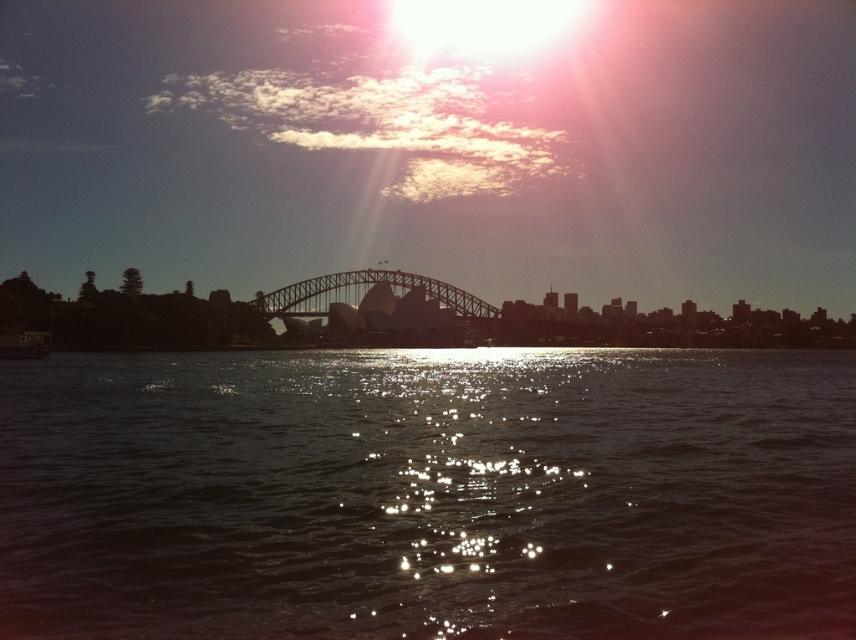
Question: Can you confirm if glistening water at center is positioned above dark gray metallic bridge at center?

Choices:
 (A) no
 (B) yes

Answer: (A)

Question: Can you confirm if glistening water at center is bigger than dark gray metallic bridge at center?

Choices:
 (A) no
 (B) yes

Answer: (B)

Question: Can you confirm if glistening water at center is bigger than dark gray metallic bridge at center?

Choices:
 (A) yes
 (B) no

Answer: (A)

Question: Which point is farther to the camera?

Choices:
 (A) (424, 294)
 (B) (105, 637)

Answer: (A)

Question: Which of the following is the farthest from the observer?

Choices:
 (A) (357, 627)
 (B) (367, 280)

Answer: (B)

Question: Which of the following is the farthest from the observer?

Choices:
 (A) dark gray metallic bridge at center
 (B) glistening water at center

Answer: (A)